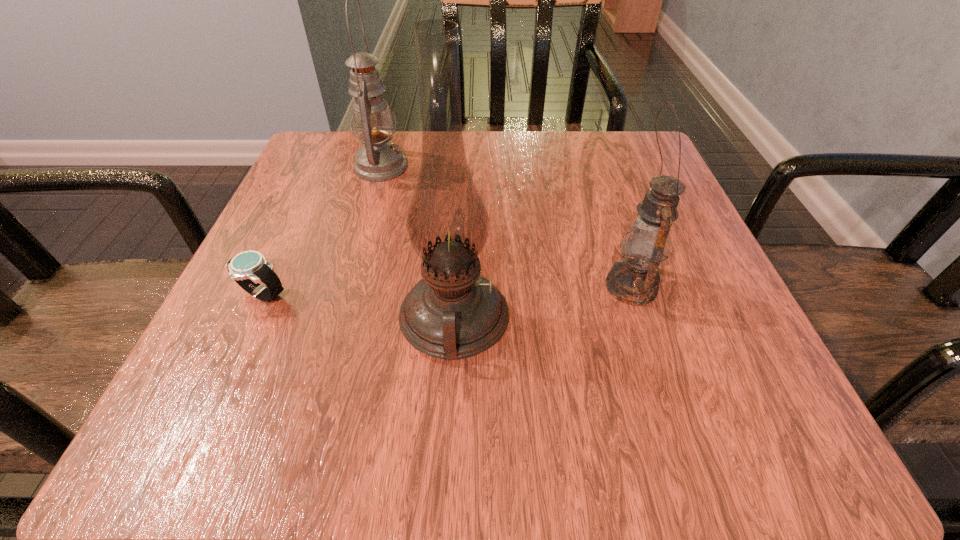
Find the location of a particular element. This screenshot has width=960, height=540. vacant area situated 0.200m on the back of the watch is located at coordinates (305, 202).

This screenshot has width=960, height=540. In order to click on object that is at the far edge in this screenshot , I will do `click(378, 160)`.

The width and height of the screenshot is (960, 540). I want to click on oil lamp that is positioned at the left edge, so click(378, 160).

Where is `watch that is positioned at the left edge`? The image size is (960, 540). watch that is positioned at the left edge is located at coordinates (x=249, y=268).

Locate an element on the screen. object that is at the right edge is located at coordinates (634, 280).

You are a GUI agent. You are given a task and a screenshot of the screen. Output one action in this format:
    pyautogui.click(x=<x>, y=<y>)
    Task: Click on the object positioned at the far left corner
    The image size is (960, 540).
    Given the screenshot: What is the action you would take?
    pyautogui.click(x=378, y=160)

The image size is (960, 540). I want to click on vacant space at the far edge of the desktop, so click(x=397, y=143).

The height and width of the screenshot is (540, 960). I want to click on vacant space at the near edge of the desktop, so click(350, 422).

Find the location of `vacant space at the left edge of the desktop`. vacant space at the left edge of the desktop is located at coordinates (252, 326).

What are the coordinates of `vacant space at the right edge of the desktop` in the screenshot? It's located at (746, 381).